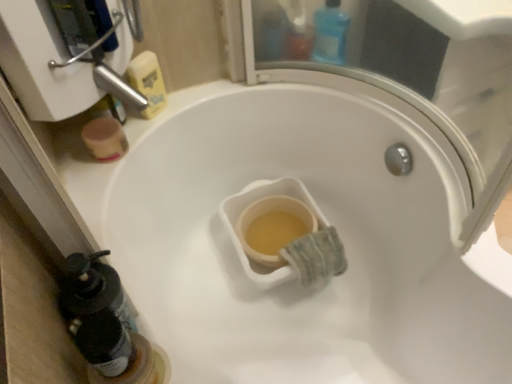
Question: Is blue plastic bottle at upper center, which is the second bottle in bottom-to-top order, in contact with translucent plastic bottle at lower left, which is the second bottle in right-to-left order?

Choices:
 (A) yes
 (B) no

Answer: (B)

Question: Is blue plastic bottle at upper center, the first bottle from the back, surrounding translucent plastic bottle at lower left, which is the second bottle in right-to-left order?

Choices:
 (A) yes
 (B) no

Answer: (B)

Question: Is blue plastic bottle at upper center, the 1th bottle when ordered from top to bottom, outside translucent plastic bottle at lower left, which ranks as the first bottle in left-to-right order?

Choices:
 (A) yes
 (B) no

Answer: (A)

Question: Does blue plastic bottle at upper center, the second bottle when ordered from front to back, have a greater width compared to translucent plastic bottle at lower left, which is the second bottle in right-to-left order?

Choices:
 (A) yes
 (B) no

Answer: (A)

Question: Considering the relative sizes of blue plastic bottle at upper center, the first bottle from the back, and translucent plastic bottle at lower left, which ranks as the first bottle in left-to-right order, in the image provided, is blue plastic bottle at upper center, the first bottle from the back, shorter than translucent plastic bottle at lower left, which ranks as the first bottle in left-to-right order,?

Choices:
 (A) yes
 (B) no

Answer: (B)

Question: From the image's perspective, is translucent plastic bottle at lower left, which ranks as the first bottle in left-to-right order, located above or below blue plastic bottle at upper center, which is the second bottle in bottom-to-top order?

Choices:
 (A) below
 (B) above

Answer: (A)

Question: From a real-world perspective, is translucent plastic bottle at lower left, acting as the first bottle starting from the front, positioned above or below blue plastic bottle at upper center, the second bottle when ordered from front to back?

Choices:
 (A) below
 (B) above

Answer: (B)

Question: Relative to blue plastic bottle at upper center, the first bottle from the back, is translucent plastic bottle at lower left, which is the second bottle in right-to-left order, in front or behind?

Choices:
 (A) behind
 (B) front

Answer: (B)

Question: Is translucent plastic bottle at lower left, which ranks as the first bottle in left-to-right order, inside or outside of blue plastic bottle at upper center, the second bottle when ordered from front to back?

Choices:
 (A) inside
 (B) outside

Answer: (B)

Question: In the image, is yellow matte sponge at upper left on the left side or the right side of translucent plastic bottle at lower left, which is the second bottle in right-to-left order?

Choices:
 (A) left
 (B) right

Answer: (A)

Question: Considering the positions of yellow matte sponge at upper left and translucent plastic bottle at lower left, acting as the first bottle starting from the front, in the image, is yellow matte sponge at upper left wider or thinner than translucent plastic bottle at lower left, acting as the first bottle starting from the front,?

Choices:
 (A) thin
 (B) wide

Answer: (B)

Question: In the image, is yellow matte sponge at upper left positioned in front of or behind translucent plastic bottle at lower left, acting as the 2th bottle starting from the top?

Choices:
 (A) behind
 (B) front

Answer: (A)

Question: Based on their sizes in the image, would you say yellow matte sponge at upper left is bigger or smaller than translucent plastic bottle at lower left, which is the first bottle from bottom to top?

Choices:
 (A) small
 (B) big

Answer: (B)

Question: Is point (96, 340) closer or farther from the camera than point (152, 97)?

Choices:
 (A) closer
 (B) farther

Answer: (A)

Question: From the image's perspective, is translucent plastic bottle at lower left, which is the second bottle in right-to-left order, above or below yellow matte sponge at upper left?

Choices:
 (A) above
 (B) below

Answer: (B)